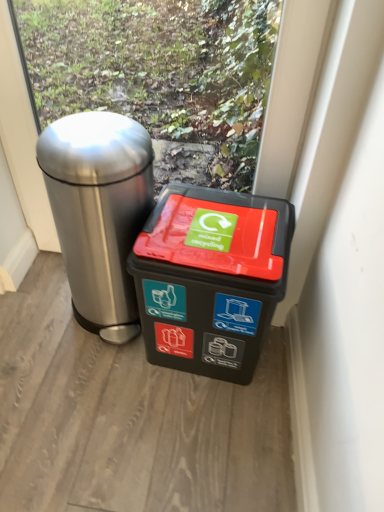
Where is `vacant area that lies in front of polished stainless steel trash can at left, which ranks as the second waste container in right-to-left order`? vacant area that lies in front of polished stainless steel trash can at left, which ranks as the second waste container in right-to-left order is located at coordinates (90, 383).